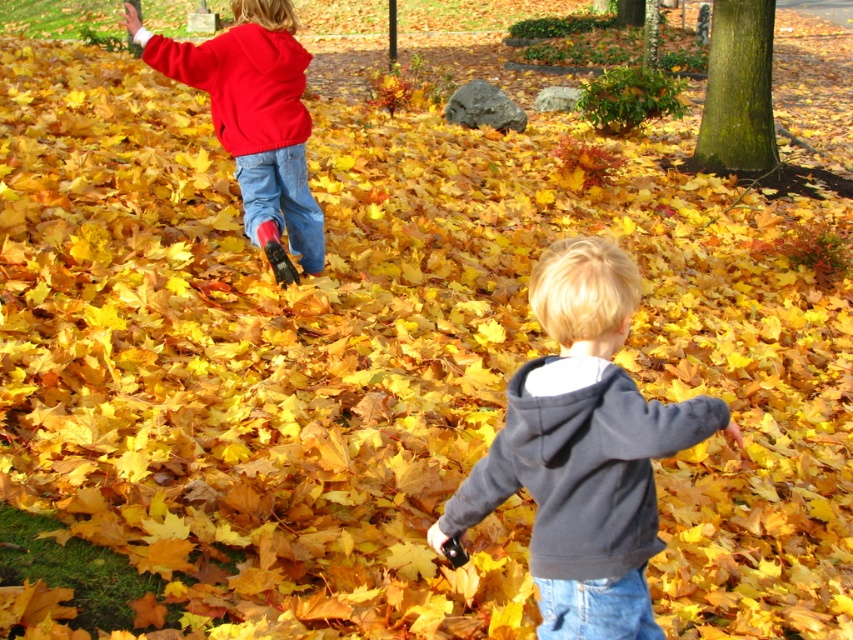
Question: Which of the following is the closest to the observer?

Choices:
 (A) jeans at left
 (B) jeans at lower right

Answer: (B)

Question: Is dark gray hoodie at center bigger than jeans at left?

Choices:
 (A) no
 (B) yes

Answer: (B)

Question: Is matte red hoodie at upper left above jeans at lower right?

Choices:
 (A) yes
 (B) no

Answer: (A)

Question: Which object is closer to the camera taking this photo?

Choices:
 (A) jeans at lower right
 (B) matte red hoodie at upper left
 (C) dark gray hoodie at center
 (D) jeans at left

Answer: (C)

Question: Can you confirm if dark gray hoodie at center is positioned to the right of jeans at lower right?

Choices:
 (A) yes
 (B) no

Answer: (B)

Question: Considering the real-world distances, which object is closest to the jeans at lower right?

Choices:
 (A) dark gray hoodie at center
 (B) matte red hoodie at upper left

Answer: (A)